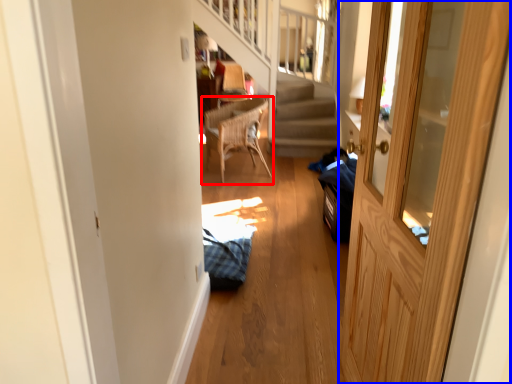
Question: Which point is further to the camera, chair (highlighted by a red box) or door (highlighted by a blue box)?

Choices:
 (A) chair
 (B) door

Answer: (A)